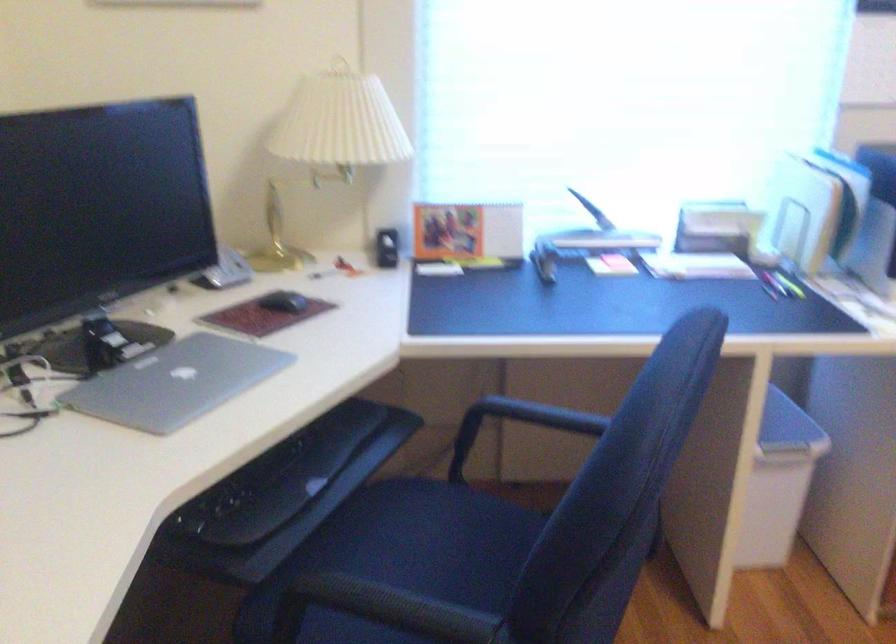
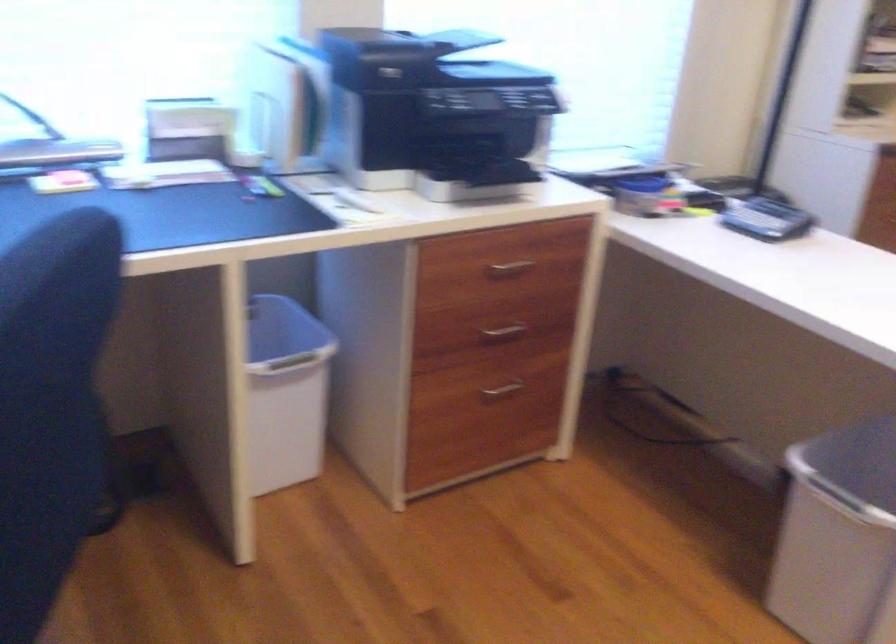
The point at (x=768, y=420) is marked in the first image. Where is the corresponding point in the second image?

(281, 328)